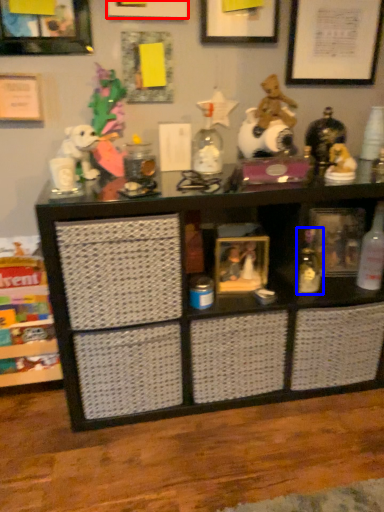
Question: Among these objects, which one is nearest to the camera, picture frame (highlighted by a red box) or toy (highlighted by a blue box)?

Choices:
 (A) picture frame
 (B) toy

Answer: (A)